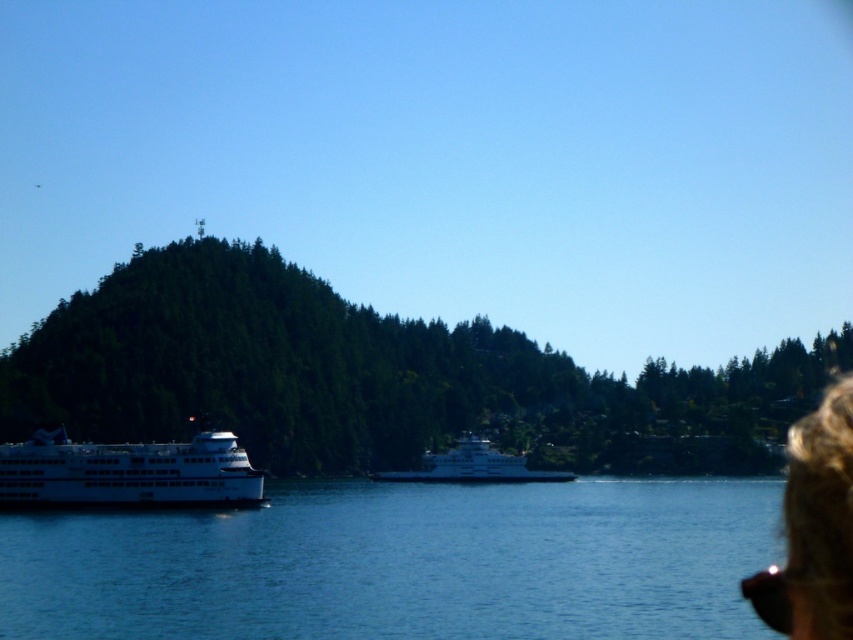
Consider the image. Does green textured hillside at center lie behind white glossy ferry at lower left?

That is True.

Which is more to the right, green textured hillside at center or white glossy ferry at lower left?

green textured hillside at center

Who is more distant from viewer, (x=137, y=330) or (x=238, y=445)?

Positioned behind is point (x=137, y=330).

Image resolution: width=853 pixels, height=640 pixels. Find the location of `green textured hillside at center`. green textured hillside at center is located at coordinates (374, 378).

Between point (538, 452) and point (488, 483), which one is positioned in front?

Point (488, 483) is in front.

Is point (759, 433) positioned after point (451, 481)?

Yes, point (759, 433) is behind point (451, 481).

Identify the location of green textured hillside at center. The height and width of the screenshot is (640, 853). (374, 378).

Does white glossy ferry at lower left have a larger size compared to white glossy ferry at center?

Actually, white glossy ferry at lower left might be smaller than white glossy ferry at center.

Is white glossy ferry at lower left thinner than white glossy ferry at center?

Indeed, white glossy ferry at lower left has a lesser width compared to white glossy ferry at center.

Measure the distance between white glossy ferry at lower left and camera.

white glossy ferry at lower left is 148.40 meters from camera.

In order to click on white glossy ferry at lower left in this screenshot , I will do `click(126, 474)`.